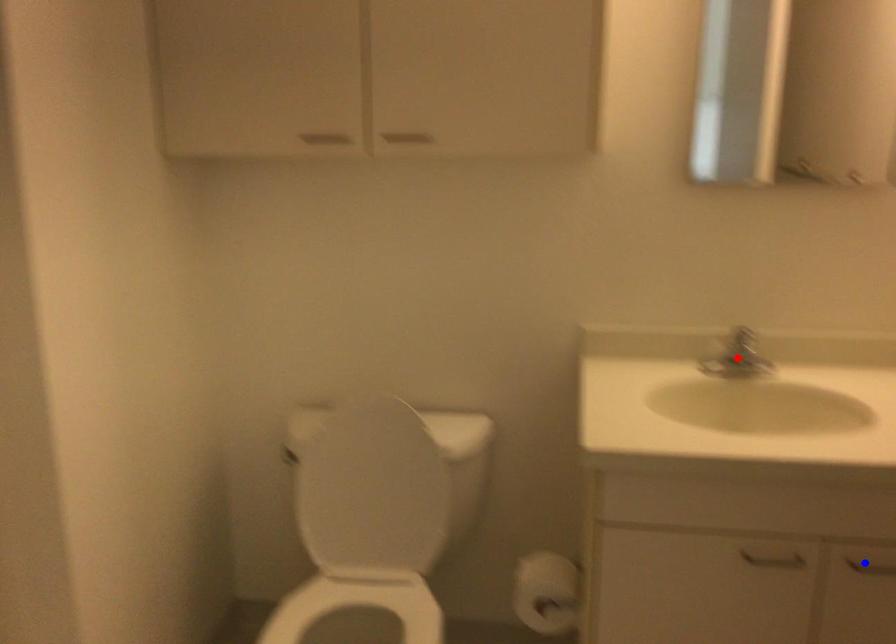
Question: Two points are marked on the image. Which point is closer to the camera?

Choices:
 (A) Blue point is closer.
 (B) Red point is closer.

Answer: (A)